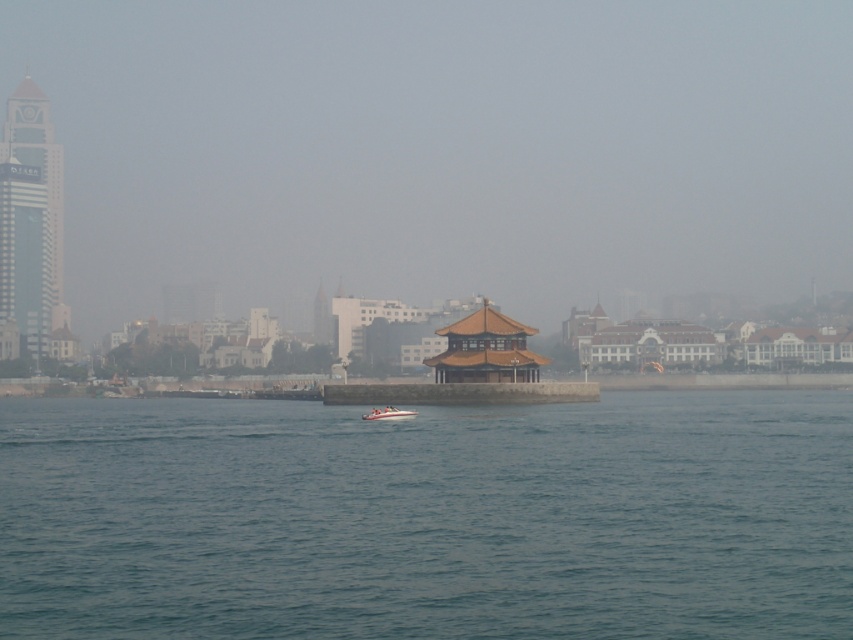
Can you confirm if clear blue water at center is positioned to the left of white glossy speedboat at center?

Yes, clear blue water at center is to the left of white glossy speedboat at center.

Consider the image. Who is lower down, clear blue water at center or white glossy speedboat at center?

clear blue water at center

Does point (53, 608) come closer to viewer compared to point (392, 406)?

That is True.

Image resolution: width=853 pixels, height=640 pixels. Find the location of `clear blue water at center`. clear blue water at center is located at coordinates (428, 518).

Who is more forward, (61, 288) or (393, 419)?

Point (393, 419) is more forward.

Which is behind, point (35, 262) or point (393, 413)?

The point (35, 262) is more distant.

Consider the image. Measure the distance between point [35,193] and camera.

Point [35,193] and camera are 275.58 meters apart.

The height and width of the screenshot is (640, 853). I want to click on gray glass skyscraper at left, so click(x=30, y=220).

The image size is (853, 640). Describe the element at coordinates (428, 518) in the screenshot. I see `clear blue water at center` at that location.

From the picture: Who is positioned more to the right, clear blue water at center or gray glass skyscraper at left?

clear blue water at center

Is point (541, 598) closer to viewer compared to point (7, 125)?

Yes, point (541, 598) is in front of point (7, 125).

Find the location of a particular element. clear blue water at center is located at coordinates (428, 518).